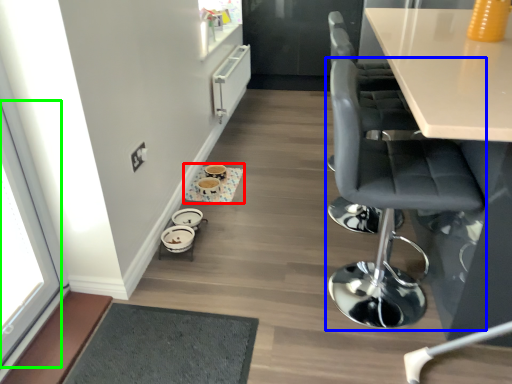
Question: Which object is positioned closest to round table (highlighted by a red box)? Select from chair (highlighted by a blue box) and window (highlighted by a green box).

Choices:
 (A) chair
 (B) window

Answer: (B)